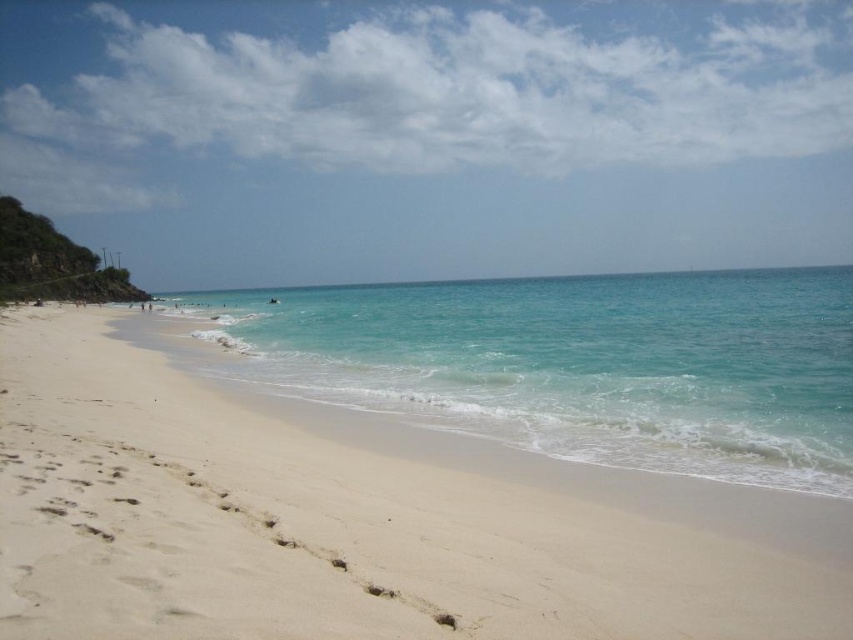
Can you confirm if white sandy beach at lower left is taller than clear blue water at center?

Incorrect, white sandy beach at lower left's height is not larger of clear blue water at center's.

Identify the location of white sandy beach at lower left. (355, 522).